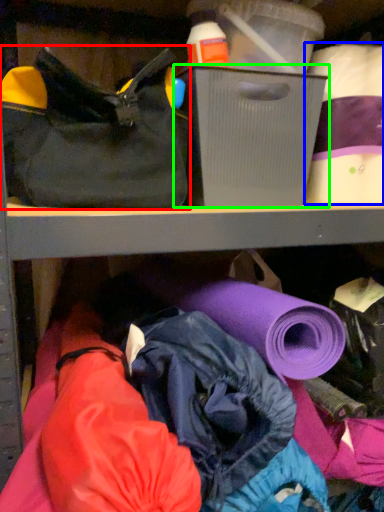
Question: Based on their relative distances, which object is nearer to handbag (highlighted by a red box)? Choose from toilet paper (highlighted by a blue box) and storage box (highlighted by a green box).

Choices:
 (A) toilet paper
 (B) storage box

Answer: (B)